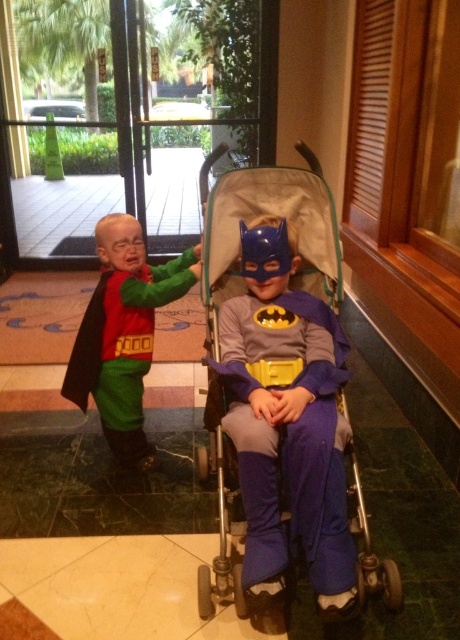
From the picture: You are standing in the hotel lobby and see two points marked on the floor. The first point is at coordinate point(x=282, y=173) and the second is at point(x=97, y=244). If you need to walk from the first point to the second point, which direction should you move relative to the second point?

You should move towards the direction of point(x=282, y=173) from point(x=97, y=244) since it is in front of it.

You are a hotel staff member who needs to move the blue fabric stroller at center and the matte green pants at left to a storage room. The storage room has a narrow doorway that is 20 inches wide. Can you move both items through the doorway at the same time?

The blue fabric stroller at center and matte green pants at left are 20.20 inches apart, so they cannot be moved through the 20 inch wide doorway simultaneously as the combined width would exceed the doorway width.